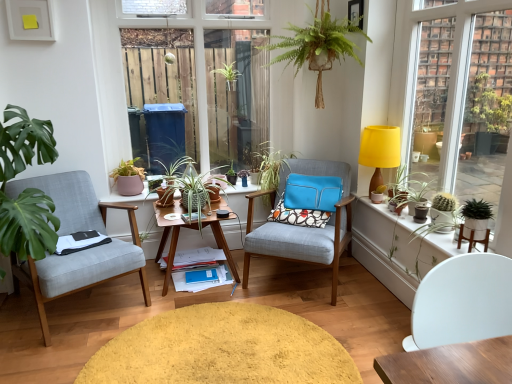
Question: From a real-world perspective, is yellow fabric lampshade at upper right positioned over green matte cactus at right based on gravity?

Choices:
 (A) no
 (B) yes

Answer: (B)

Question: Is yellow fabric lampshade at upper right completely or partially outside of green matte cactus at right?

Choices:
 (A) no
 (B) yes

Answer: (B)

Question: Can you confirm if yellow fabric lampshade at upper right is thinner than green matte cactus at right?

Choices:
 (A) no
 (B) yes

Answer: (B)

Question: Does yellow fabric lampshade at upper right have a smaller size compared to green matte cactus at right?

Choices:
 (A) no
 (B) yes

Answer: (B)

Question: Is yellow fabric lampshade at upper right facing towards green matte cactus at right?

Choices:
 (A) yes
 (B) no

Answer: (B)

Question: From a real-world perspective, relative to textured fabric armchair at center, which ranks as the 2th chair in right-to-left order, is light gray fabric chair at left, which is the 1th chair from left to right, vertically above or below?

Choices:
 (A) below
 (B) above

Answer: (B)

Question: Considering the relative positions of light gray fabric chair at left, which is the 1th chair from left to right, and textured fabric armchair at center, the third chair viewed from the front, in the image provided, is light gray fabric chair at left, which is the 1th chair from left to right, to the left or to the right of textured fabric armchair at center, the third chair viewed from the front,?

Choices:
 (A) right
 (B) left

Answer: (B)

Question: Is point (16, 276) positioned closer to the camera than point (333, 221)?

Choices:
 (A) farther
 (B) closer

Answer: (B)

Question: Considering the positions of light gray fabric chair at left, which is counted as the third chair, starting from the right, and textured fabric armchair at center, the third chair viewed from the front, in the image, is light gray fabric chair at left, which is counted as the third chair, starting from the right, wider or thinner than textured fabric armchair at center, the third chair viewed from the front,?

Choices:
 (A) thin
 (B) wide

Answer: (A)

Question: Considering their positions, is white matte chair at lower right, the first chair when ordered from front to back, located in front of or behind matte black pot at right, which is counted as the first flowerpot, starting from the front?

Choices:
 (A) front
 (B) behind

Answer: (A)

Question: Looking at the image, does white matte chair at lower right, the first chair when ordered from front to back, seem bigger or smaller compared to matte black pot at right, the 1th flowerpot viewed from the right?

Choices:
 (A) small
 (B) big

Answer: (B)

Question: Is white matte chair at lower right, which is the third chair from left to right, inside the boundaries of matte black pot at right, which is counted as the first flowerpot, starting from the front, or outside?

Choices:
 (A) inside
 (B) outside

Answer: (B)

Question: Looking at their shapes, would you say white matte chair at lower right, which is the third chair from left to right, is wider or thinner than matte black pot at right, which is counted as the first flowerpot, starting from the front?

Choices:
 (A) thin
 (B) wide

Answer: (B)

Question: In terms of width, does matte brown flowerpot at center, placed as the first flowerpot when sorted from back to front, look wider or thinner when compared to wooden desk at center?

Choices:
 (A) wide
 (B) thin

Answer: (B)

Question: Considering the positions of matte brown flowerpot at center, arranged as the fourth flowerpot when viewed from the front, and wooden desk at center in the image, is matte brown flowerpot at center, arranged as the fourth flowerpot when viewed from the front, taller or shorter than wooden desk at center?

Choices:
 (A) short
 (B) tall

Answer: (A)